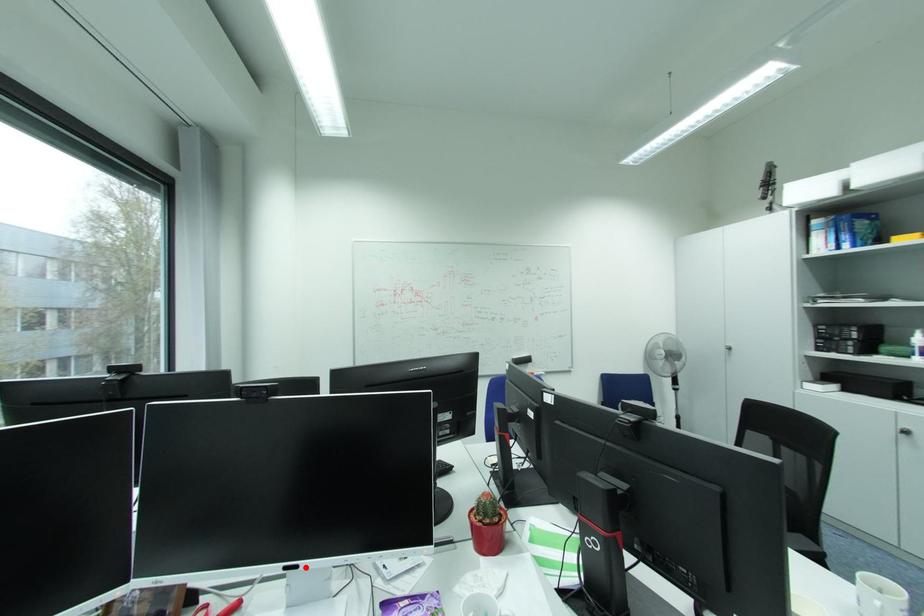
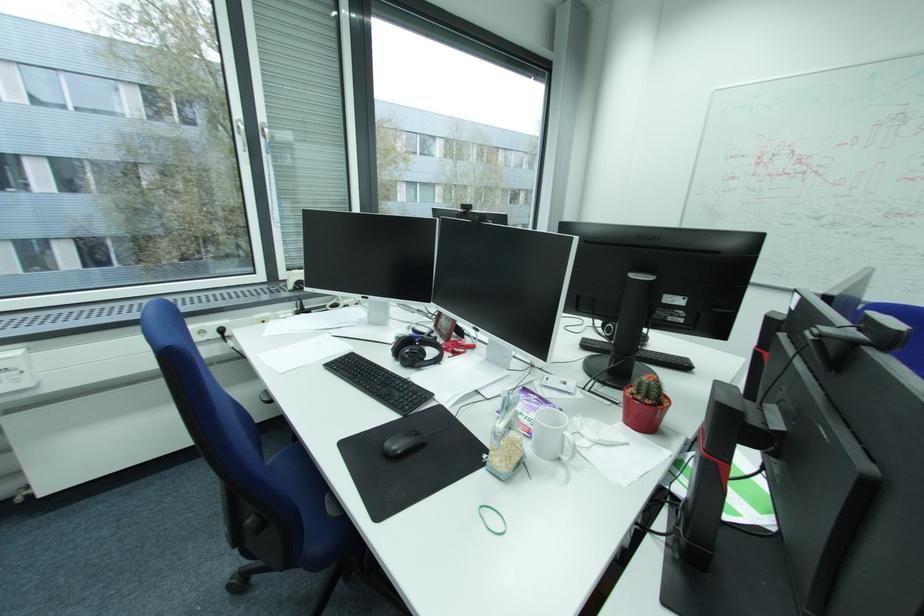
In the second image, find the point that corresponds to the highlighted location in the first image.

(487, 331)